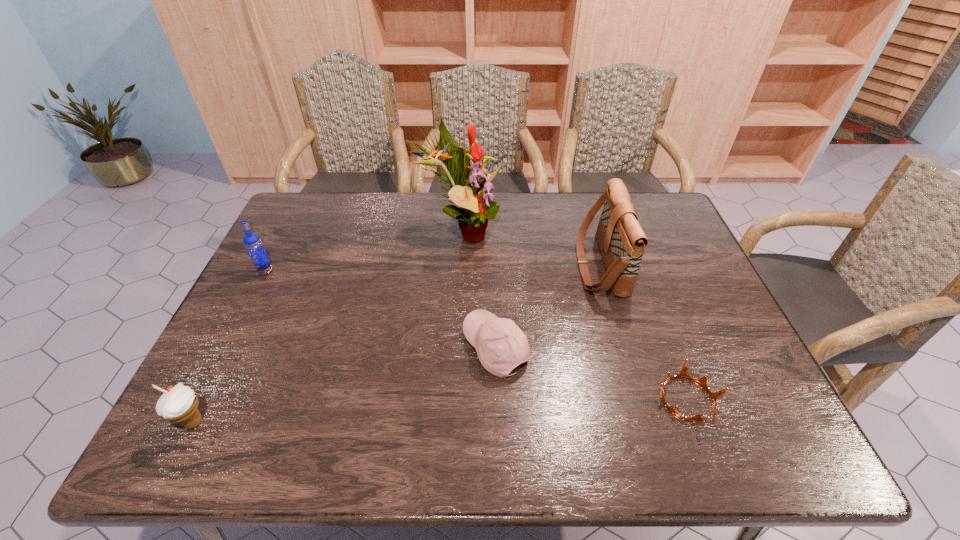
Where is `vodka present at the left edge`? vodka present at the left edge is located at coordinates (252, 242).

Where is `icecream that is at the left edge`? This screenshot has height=540, width=960. icecream that is at the left edge is located at coordinates (180, 403).

Identify the location of object at the right edge. The width and height of the screenshot is (960, 540). (683, 374).

Where is `object located at the near left corner`? The image size is (960, 540). object located at the near left corner is located at coordinates (180, 403).

At what (x,y) coordinates should I click in order to perform the action: click on object positioned at the near right corner. Please return your answer as a coordinate pair (x, y). Image resolution: width=960 pixels, height=540 pixels. Looking at the image, I should click on (683, 374).

This screenshot has height=540, width=960. In order to click on vacant position at the far edge of the desktop in this screenshot , I will do `click(505, 217)`.

Locate an element on the screen. Image resolution: width=960 pixels, height=540 pixels. free space at the near edge is located at coordinates (468, 456).

Find the location of `free space at the left edge`. free space at the left edge is located at coordinates (257, 285).

I want to click on vacant area at the far left corner, so click(x=300, y=219).

Where is `free space at the far right corner of the desktop`? Image resolution: width=960 pixels, height=540 pixels. free space at the far right corner of the desktop is located at coordinates (632, 201).